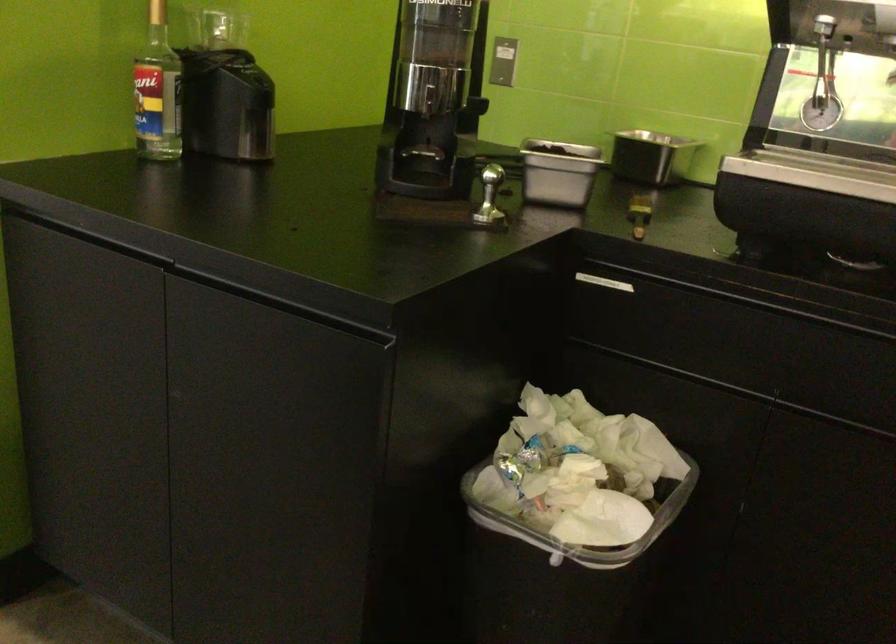
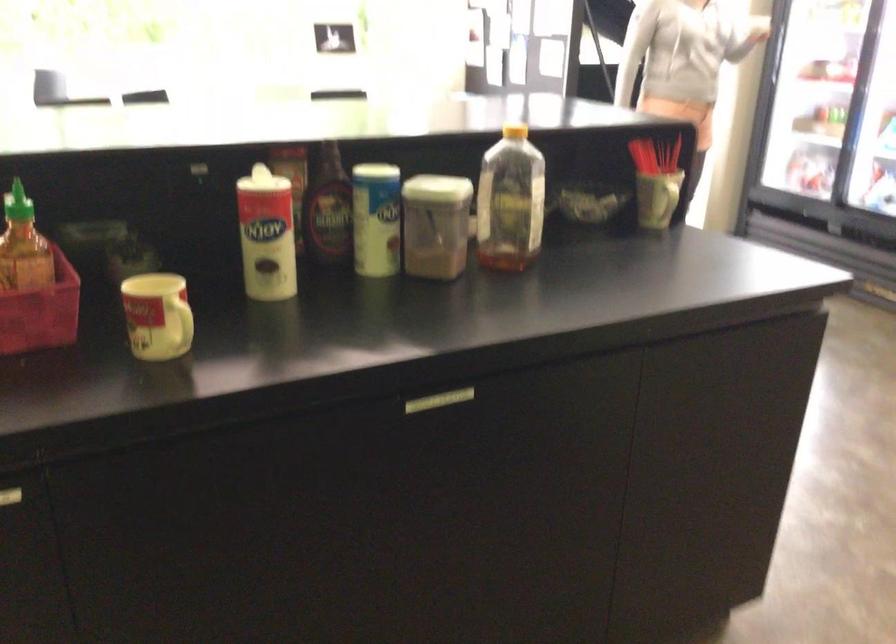
The images are taken continuously from a first-person perspective. In which direction is your viewpoint rotating?

The camera rotated toward left-down.